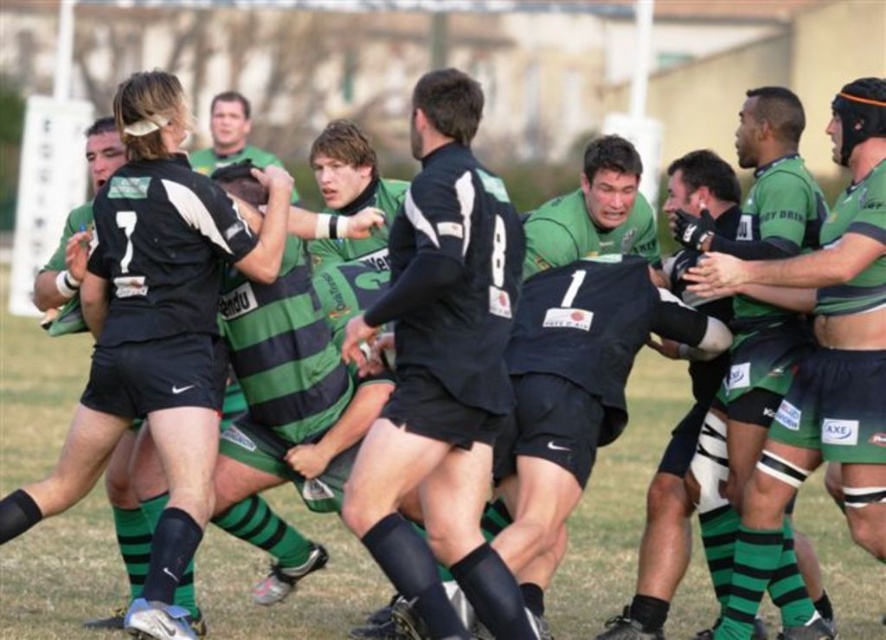
You are a sports analyst observing the rugby scrum. You notice the matte black jersey at center and the green striped jersey at center. Which jersey is bigger in size?

The matte black jersey at center has a larger size compared to the green striped jersey at center.

You are a rugby coach analyzing the scrum formation. The point of focus is at point (443, 369). Which player is positioned exactly at that coordinate?

The matte black jersey at center is positioned exactly at point (443, 369).